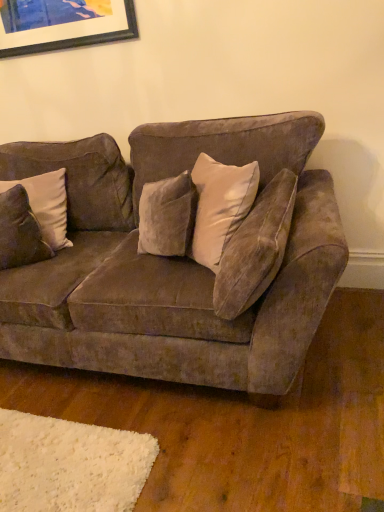
Question: Considering the positions of velvet brown couch at center and matte black picture frame at upper left in the image, is velvet brown couch at center wider or thinner than matte black picture frame at upper left?

Choices:
 (A) wide
 (B) thin

Answer: (A)

Question: From their relative heights in the image, would you say velvet brown couch at center is taller or shorter than matte black picture frame at upper left?

Choices:
 (A) tall
 (B) short

Answer: (A)

Question: Based on their relative distances, which object is farther from the velvet brown pillow at left?

Choices:
 (A) matte black picture frame at upper left
 (B) velvet brown couch at center

Answer: (A)

Question: Based on their relative distances, which object is farther from the velvet brown pillow at left?

Choices:
 (A) velvet brown couch at center
 (B) matte black picture frame at upper left

Answer: (B)